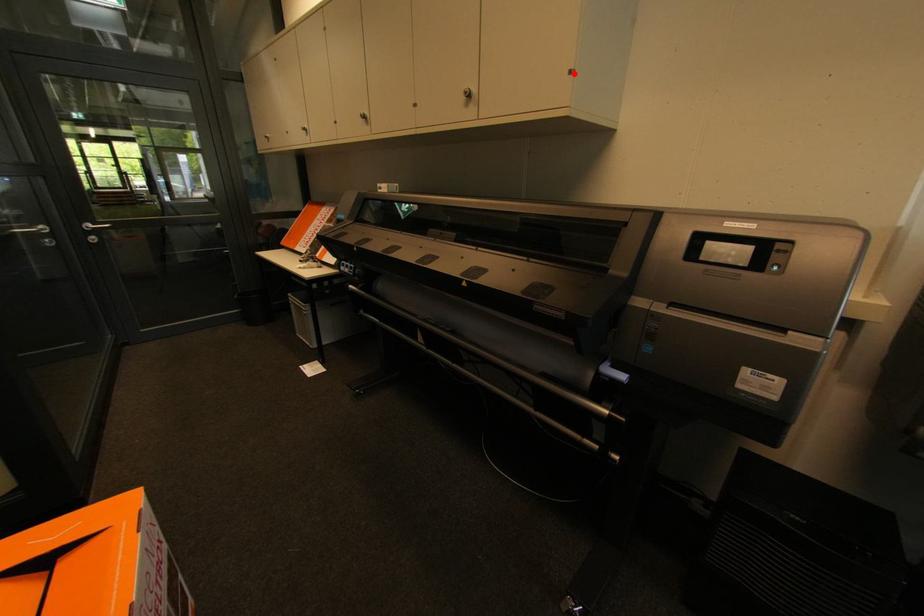
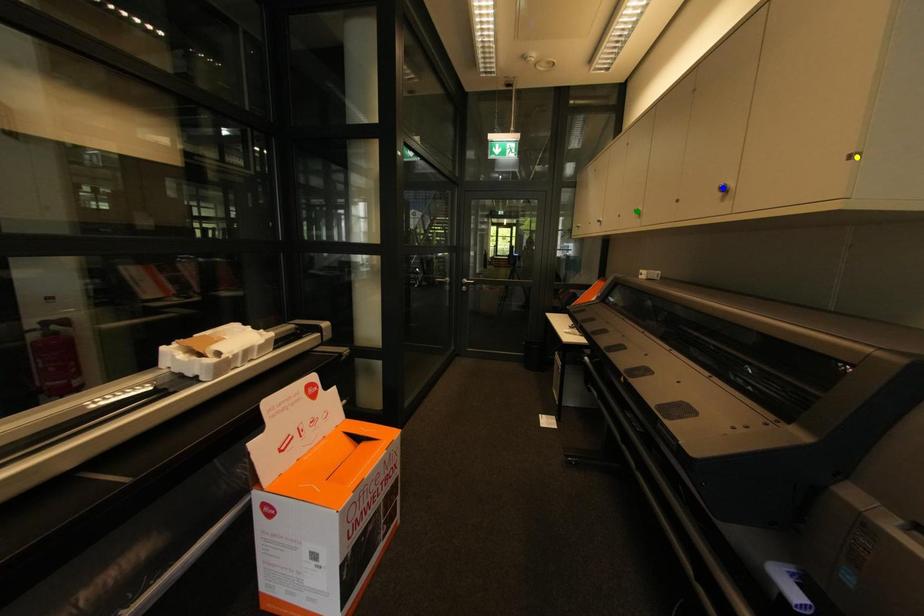
Question: I am providing you with two images of the same scene from different viewpoints. A red point is marked on the first image. You are given multiple points on the second image. Which point in image 2 is actually the same real-world point as the red point in image 1?

Choices:
 (A) yellow point
 (B) blue point
 (C) green point

Answer: (A)